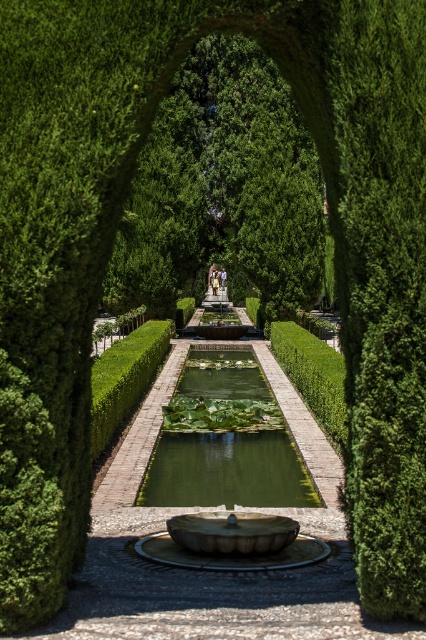
Question: Estimate the real-world distances between objects in this image. Which object is farther from the green leafy tree at center?

Choices:
 (A) green mossy pond at center
 (B) green polished stone hedge at center

Answer: (A)

Question: Can you confirm if green mossy pond at center is positioned above green polished stone hedge at center?

Choices:
 (A) no
 (B) yes

Answer: (A)

Question: Which of the following is the farthest from the observer?

Choices:
 (A) (164, 456)
 (B) (284, 307)
 (C) (126, 342)

Answer: (B)

Question: Which object is the closest to the green polished stone hedge at center?

Choices:
 (A) green mossy pond at center
 (B) green leafy tree at center

Answer: (A)

Question: Does green leafy tree at center have a greater width compared to green mossy pond at center?

Choices:
 (A) yes
 (B) no

Answer: (A)

Question: Does green leafy tree at center have a smaller size compared to green mossy pond at center?

Choices:
 (A) yes
 (B) no

Answer: (B)